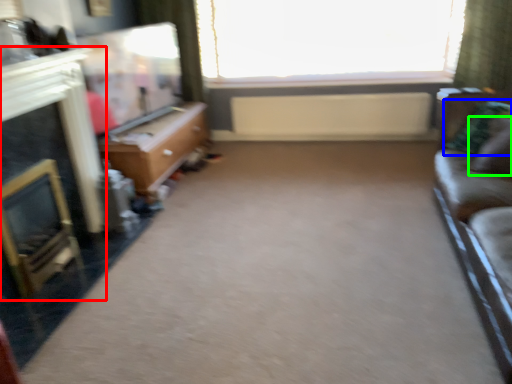
Question: Which is farther away from fireplace (highlighted by a red box)? pillow (highlighted by a blue box) or pillow (highlighted by a green box)?

Choices:
 (A) pillow
 (B) pillow

Answer: (B)